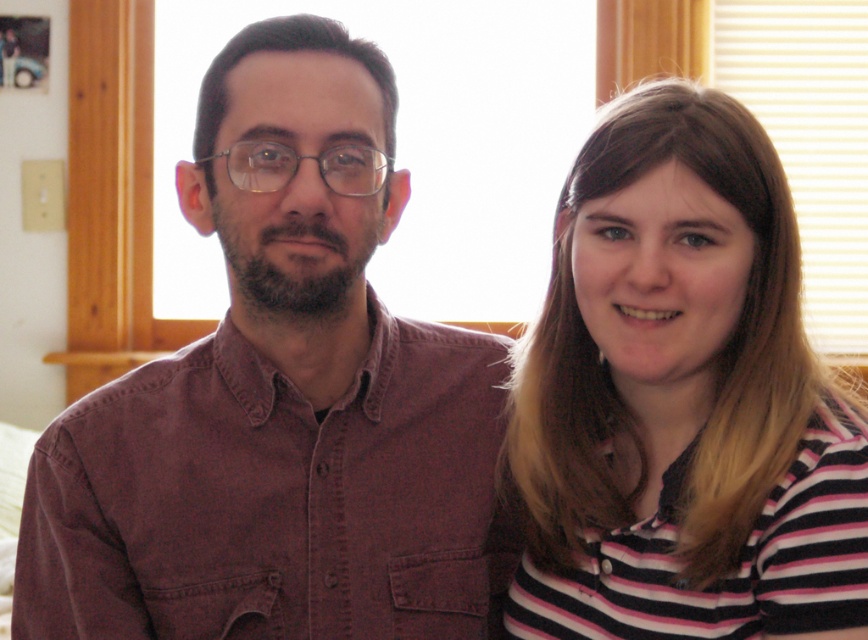
Does matte brown shirt at left appear under striped cotton shirt at right?

Incorrect, matte brown shirt at left is not positioned below striped cotton shirt at right.

Identify the location of matte brown shirt at left. This screenshot has height=640, width=868. (281, 403).

Can you confirm if matte brown shirt at left is wider than pink striped shirt at right?

Correct, the width of matte brown shirt at left exceeds that of pink striped shirt at right.

From the picture: Does matte brown shirt at left have a larger size compared to pink striped shirt at right?

Indeed, matte brown shirt at left has a larger size compared to pink striped shirt at right.

Is point (268, 557) less distant than point (600, 273)?

That is False.

Find the location of a particular element. matte brown shirt at left is located at coordinates (281, 403).

Which is more to the left, pink striped shirt at right or striped cotton shirt at right?

Positioned to the left is striped cotton shirt at right.

Does pink striped shirt at right appear on the right side of striped cotton shirt at right?

Correct, you'll find pink striped shirt at right to the right of striped cotton shirt at right.

Is point (653, 145) less distant than point (830, 609)?

No, (653, 145) is further to viewer.

At what (x,y) coordinates should I click in order to perform the action: click on pink striped shirt at right. Please return your answer as a coordinate pair (x, y). The height and width of the screenshot is (640, 868). Looking at the image, I should click on 681,397.